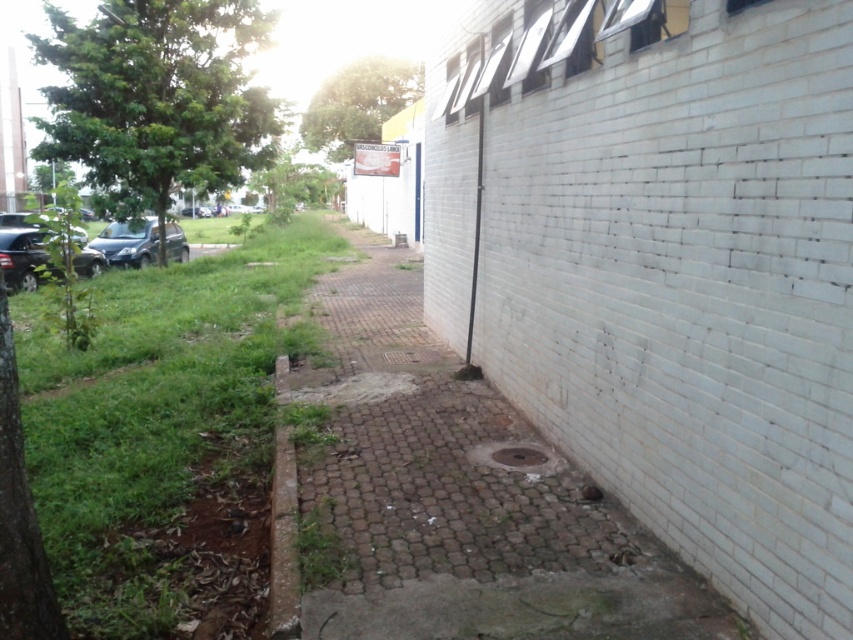
The height and width of the screenshot is (640, 853). What do you see at coordinates (22, 257) in the screenshot? I see `shiny black car at left` at bounding box center [22, 257].

Can you confirm if shiny black car at left is positioned above brown concrete drain at center?

Yes, shiny black car at left is above brown concrete drain at center.

Who is more forward, (88, 252) or (512, 465)?

Point (512, 465) is in front.

Where is `shiny black car at left`? This screenshot has height=640, width=853. shiny black car at left is located at coordinates (22, 257).

In the scene shown: Measure the distance between shiny black car at left and metallic gray manhole cover at center.

shiny black car at left is 8.76 meters from metallic gray manhole cover at center.

Based on the photo, is shiny black car at left to the left of metallic gray manhole cover at center from the viewer's perspective?

Correct, you'll find shiny black car at left to the left of metallic gray manhole cover at center.

Between point (38, 250) and point (529, 445), which one is positioned behind?

The point (38, 250) is more distant.

At what (x,y) coordinates should I click in order to perform the action: click on shiny black car at left. Please return your answer as a coordinate pair (x, y). This screenshot has width=853, height=640. Looking at the image, I should click on (22, 257).

Is point (125, 490) positioned after point (498, 449)?

No.

Describe the element at coordinates (160, 422) in the screenshot. I see `green grass at left` at that location.

Image resolution: width=853 pixels, height=640 pixels. I want to click on green grass at left, so click(160, 422).

The image size is (853, 640). I want to click on green grass at left, so click(x=160, y=422).